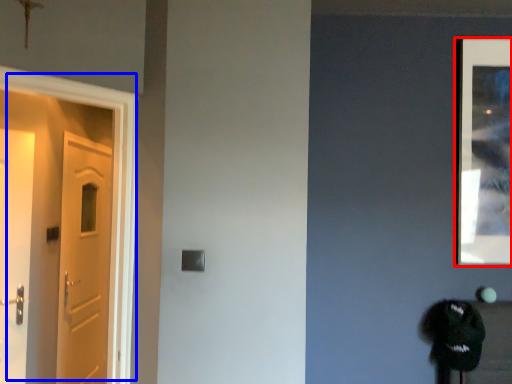
Question: Which object appears closest to the camera in this image, picture frame (highlighted by a red box) or door (highlighted by a blue box)?

Choices:
 (A) picture frame
 (B) door

Answer: (B)